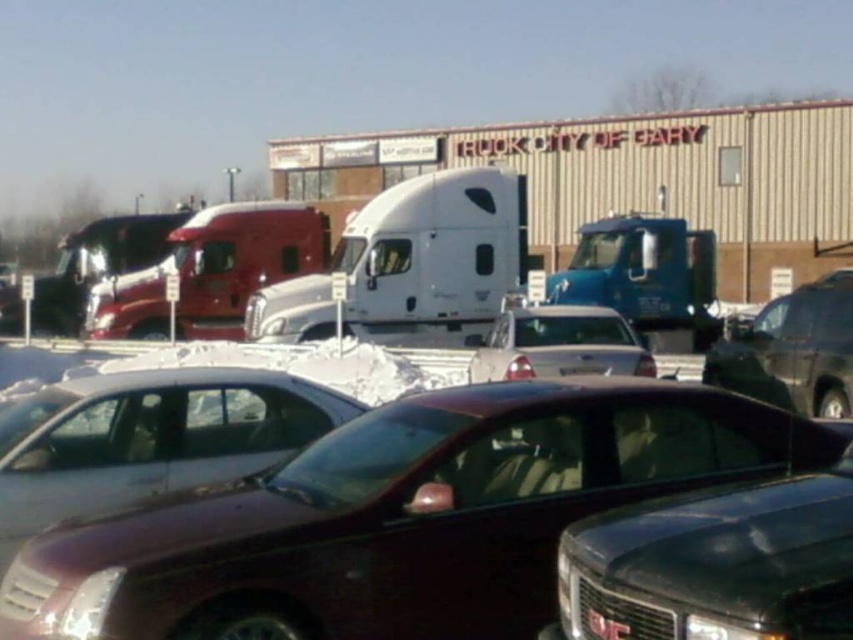
Question: Is shiny maroon sedan at center wider than white glossy sedan at center?

Choices:
 (A) yes
 (B) no

Answer: (A)

Question: Is shiny maroon sedan at center bigger than white glossy sedan at center?

Choices:
 (A) no
 (B) yes

Answer: (B)

Question: Among these points, which one is nearest to the camera?

Choices:
 (A) (120, 317)
 (B) (700, 260)
 (C) (592, 612)
 (D) (529, 573)

Answer: (C)

Question: Is black glossy suv at center bigger than shiny black suv at right?

Choices:
 (A) yes
 (B) no

Answer: (B)

Question: Which of these objects is positioned farthest from the blue metallic trailer truck at center?

Choices:
 (A) white glossy sedan at center
 (B) shiny maroon sedan at center

Answer: (B)

Question: Which of the following is the farthest from the observer?

Choices:
 (A) (553, 310)
 (B) (238, 300)

Answer: (B)